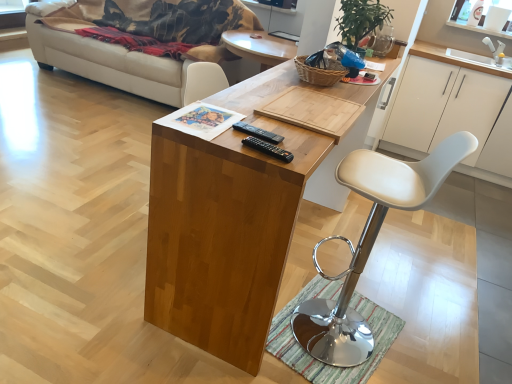
Question: Is white matte cabinet at right shorter than white leather stool at center?

Choices:
 (A) yes
 (B) no

Answer: (A)

Question: Is white matte cabinet at right bigger than white leather stool at center?

Choices:
 (A) yes
 (B) no

Answer: (A)

Question: Can you confirm if white matte cabinet at right is positioned to the left of white leather stool at center?

Choices:
 (A) no
 (B) yes

Answer: (A)

Question: From a real-world perspective, is white matte cabinet at right positioned over white leather stool at center based on gravity?

Choices:
 (A) no
 (B) yes

Answer: (A)

Question: Can we say white matte cabinet at right lies outside white leather stool at center?

Choices:
 (A) no
 (B) yes

Answer: (B)

Question: Is white matte cabinet at right directly adjacent to white leather stool at center?

Choices:
 (A) no
 (B) yes

Answer: (A)

Question: Does white leather stool at center contain striped fabric mat at lower center?

Choices:
 (A) no
 (B) yes

Answer: (A)

Question: Can you confirm if white leather stool at center is thinner than striped fabric mat at lower center?

Choices:
 (A) yes
 (B) no

Answer: (A)

Question: Considering the relative positions of white leather stool at center and striped fabric mat at lower center in the image provided, is white leather stool at center in front of striped fabric mat at lower center?

Choices:
 (A) yes
 (B) no

Answer: (A)

Question: Is white leather stool at center bigger than striped fabric mat at lower center?

Choices:
 (A) no
 (B) yes

Answer: (B)

Question: Is the position of white leather stool at center more distant than that of striped fabric mat at lower center?

Choices:
 (A) no
 (B) yes

Answer: (A)

Question: Is white leather stool at center aimed at striped fabric mat at lower center?

Choices:
 (A) yes
 (B) no

Answer: (B)

Question: From a real-world perspective, is white leather stool at center positioned over white matte cabinet at right based on gravity?

Choices:
 (A) no
 (B) yes

Answer: (B)